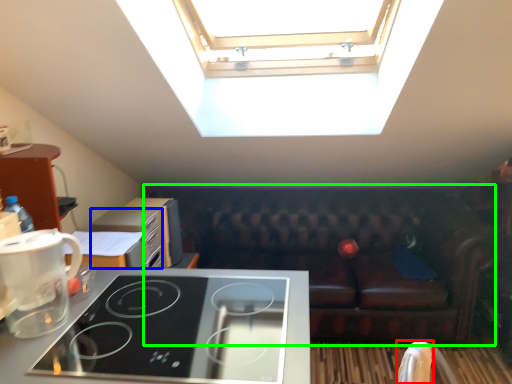
Question: Which object is the closest to the armchair (highlighted by a red box)? Choose among these: appliance (highlighted by a blue box) or studio couch (highlighted by a green box).

Choices:
 (A) appliance
 (B) studio couch

Answer: (A)